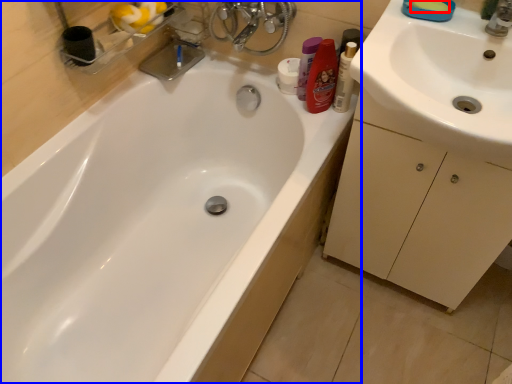
Question: Which object is further to the camera taking this photo, soap (highlighted by a red box) or bathtub (highlighted by a blue box)?

Choices:
 (A) soap
 (B) bathtub

Answer: (A)